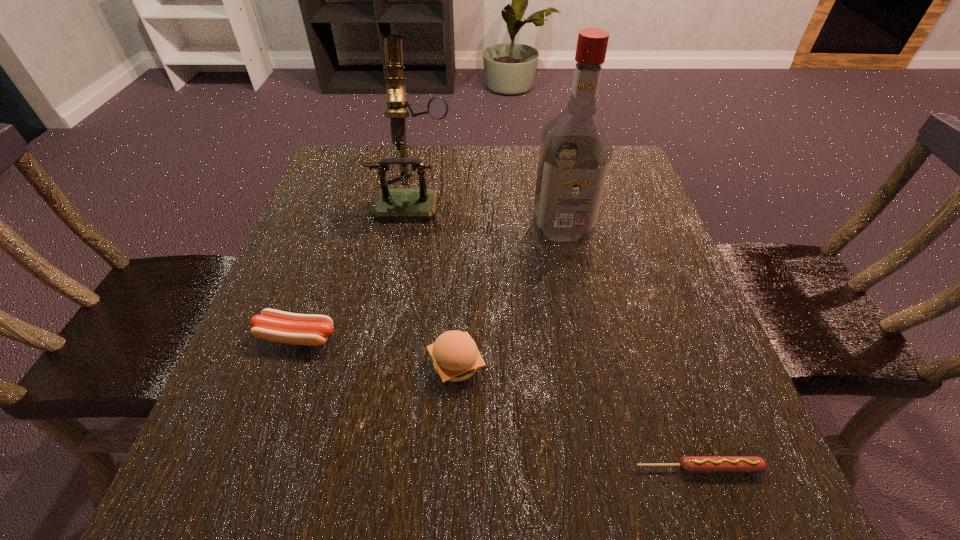
In order to click on vacant space located on the front of the taller sausage in this screenshot , I will do `click(242, 492)`.

Find the location of a particular element. The height and width of the screenshot is (540, 960). vacant region located 0.120m on the left of the nearest object is located at coordinates (548, 468).

Identify the location of object situated at the far edge. (391, 204).

The height and width of the screenshot is (540, 960). In order to click on object that is at the near edge in this screenshot , I will do `click(688, 464)`.

What are the coordinates of `microscope present at the left edge` in the screenshot? It's located at (391, 204).

Where is `sausage at the left edge`? This screenshot has height=540, width=960. sausage at the left edge is located at coordinates (273, 325).

Find the location of a particular element. Image resolution: width=960 pixels, height=540 pixels. liquor that is at the right edge is located at coordinates (575, 152).

What are the coordinates of `sausage that is at the right edge` in the screenshot? It's located at point(688,464).

This screenshot has width=960, height=540. What are the coordinates of `object situated at the far left corner` in the screenshot? It's located at (391, 204).

You are a GUI agent. You are given a task and a screenshot of the screen. Output one action in this format:
    pyautogui.click(x=<x>, y=<y>)
    Task: Click on the object located at the near right corner
    This screenshot has height=540, width=960.
    Given the screenshot: What is the action you would take?
    pyautogui.click(x=688, y=464)